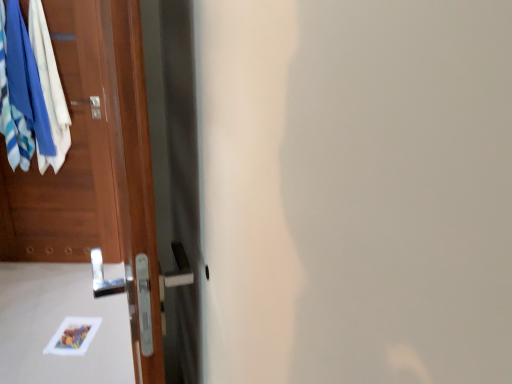
Question: In the image, is blue cotton socks at left positioned in front of or behind wooden door at left?

Choices:
 (A) behind
 (B) front

Answer: (A)

Question: From a real-world perspective, is blue cotton socks at left physically located above or below wooden door at left?

Choices:
 (A) below
 (B) above

Answer: (B)

Question: Is blue cotton socks at left wider or thinner than wooden door at left?

Choices:
 (A) thin
 (B) wide

Answer: (A)

Question: In the image, is wooden door at left positioned in front of or behind blue cotton socks at left?

Choices:
 (A) front
 (B) behind

Answer: (A)

Question: From the image's perspective, is wooden door at left located above or below blue cotton socks at left?

Choices:
 (A) above
 (B) below

Answer: (B)

Question: From a real-world perspective, relative to blue cotton socks at left, is wooden door at left vertically above or below?

Choices:
 (A) above
 (B) below

Answer: (B)

Question: Looking at their shapes, would you say wooden door at left is wider or thinner than blue cotton socks at left?

Choices:
 (A) thin
 (B) wide

Answer: (B)